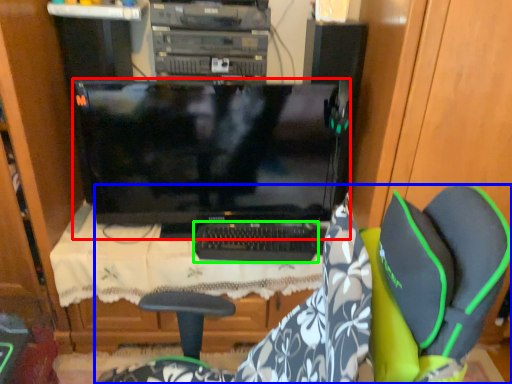
Question: Estimate the real-world distances between objects in this image. Which object is farther from computer monitor (highlighted by a red box), chair (highlighted by a blue box) or computer keyboard (highlighted by a green box)?

Choices:
 (A) chair
 (B) computer keyboard

Answer: (A)